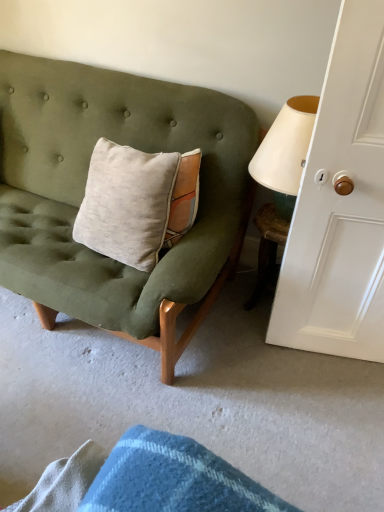
Where is `wooden table at lower right`? The image size is (384, 512). wooden table at lower right is located at coordinates (267, 247).

What do you see at coordinates (84, 191) in the screenshot? I see `matte green fabric couch at left` at bounding box center [84, 191].

Where is `wooden table at lower right`? The image size is (384, 512). wooden table at lower right is located at coordinates (267, 247).

From a real-world perspective, relative to matte green fabric couch at left, is white painted wood door at right vertically above or below?

From a real-world perspective, white painted wood door at right is physically above matte green fabric couch at left.

In the scene shown: Can you confirm if white painted wood door at right is positioned to the left of matte green fabric couch at left?

Incorrect, white painted wood door at right is not on the left side of matte green fabric couch at left.

Is white painted wood door at right turned away from matte green fabric couch at left?

That's not correct — white painted wood door at right is not looking away from matte green fabric couch at left.

Is point (374, 330) closer to camera compared to point (27, 137)?

Yes.

Identify the location of door in front of the wooden table at lower right. (340, 205).

Is the surface of wooden table at lower right in direct contact with white painted wood door at right?

No, wooden table at lower right is not making contact with white painted wood door at right.

From a real-world perspective, which is physically below, wooden table at lower right or white painted wood door at right?

In real-world perspective, wooden table at lower right is lower.

Does white painted wood door at right lie behind wooden table at lower right?

No, it is not.

From the picture: From the image's perspective, between white painted wood door at right and wooden table at lower right, which one is located above?

white painted wood door at right, from the image's perspective.

Is white painted wood door at right not inside wooden table at lower right?

Yes.

Is white painted wood door at right bigger or smaller than wooden table at lower right?

Considering their sizes, white painted wood door at right takes up more space than wooden table at lower right.

Is wooden table at lower right completely or partially outside of matte green fabric couch at left?

Yes, wooden table at lower right is not within matte green fabric couch at left.

Locate an element on the screen. table below the matte green fabric couch at left (from a real-world perspective) is located at coordinates (267, 247).

Are wooden table at lower right and matte green fabric couch at left far apart?

No, wooden table at lower right is not far away from matte green fabric couch at left.

Considering the relative sizes of wooden table at lower right and matte green fabric couch at left in the image provided, is wooden table at lower right wider than matte green fabric couch at left?

Incorrect, the width of wooden table at lower right does not surpass that of matte green fabric couch at left.

Based on the photo, is matte green fabric couch at left in front of white painted wood door at right?

No, it is behind white painted wood door at right.

From the image's perspective, which one is positioned lower, matte green fabric couch at left or white painted wood door at right?

white painted wood door at right is shown below in the image.

Is white painted wood door at right completely or partially inside matte green fabric couch at left?

No.

Which is more to the right, matte green fabric couch at left or wooden table at lower right?

From the viewer's perspective, wooden table at lower right appears more on the right side.

Based on their sizes in the image, would you say matte green fabric couch at left is bigger or smaller than wooden table at lower right?

Clearly, matte green fabric couch at left is larger in size than wooden table at lower right.

From the image's perspective, between matte green fabric couch at left and wooden table at lower right, which one is located above?

From the image's view, matte green fabric couch at left is above.

Could you tell me if matte green fabric couch at left is facing wooden table at lower right?

No, matte green fabric couch at left is not facing towards wooden table at lower right.

Locate an element on the screen. door lying in front of the matte green fabric couch at left is located at coordinates (340, 205).

At what (x,y) coordinates should I click in order to perform the action: click on table behind the white painted wood door at right. Please return your answer as a coordinate pair (x, y). The height and width of the screenshot is (512, 384). Looking at the image, I should click on (267, 247).

From the image, which object appears to be farther from matte green fabric couch at left, wooden table at lower right or white painted wood door at right?

wooden table at lower right is positioned further to the anchor matte green fabric couch at left.

When comparing their distances from matte green fabric couch at left, does white painted wood door at right or wooden table at lower right seem closer?

Among the two, white painted wood door at right is located nearer to matte green fabric couch at left.

Based on their spatial positions, is matte green fabric couch at left or white painted wood door at right closer to wooden table at lower right?

Based on the image, white painted wood door at right appears to be nearer to wooden table at lower right.

Estimate the real-world distances between objects in this image. Which object is closer to white painted wood door at right, matte green fabric couch at left or wooden table at lower right?

wooden table at lower right lies closer to white painted wood door at right than the other object.

Estimate the real-world distances between objects in this image. Which object is closer to white painted wood door at right, wooden table at lower right or matte green fabric couch at left?

Based on the image, wooden table at lower right appears to be nearer to white painted wood door at right.

When comparing their distances from wooden table at lower right, does white painted wood door at right or matte green fabric couch at left seem closer?

Based on the image, white painted wood door at right appears to be nearer to wooden table at lower right.

Where is `table located between matte green fabric couch at left and white painted wood door at right in the left-right direction`? This screenshot has height=512, width=384. table located between matte green fabric couch at left and white painted wood door at right in the left-right direction is located at coordinates (267, 247).